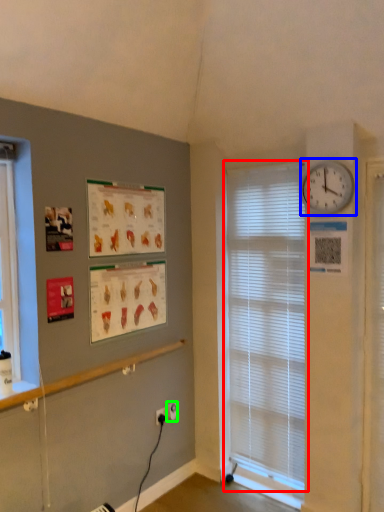
Question: Which is farther away from window blind (highlighted by a red box)? wall clock (highlighted by a blue box) or electric outlet (highlighted by a green box)?

Choices:
 (A) wall clock
 (B) electric outlet

Answer: (B)